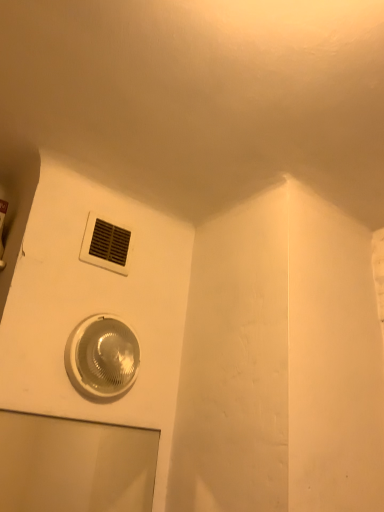
In order to face transparent glass door at lower left, should I rotate leftwards or rightwards?

Turn left by 14.356 degrees to look at transparent glass door at lower left.

Find the location of a particular element. transparent glass door at lower left is located at coordinates [x=74, y=465].

Between white plastic air conditioning at upper center and translucent plastic light fixture at lower center, which one is positioned behind?

white plastic air conditioning at upper center is behind.

Considering the positions of objects white plastic air conditioning at upper center and translucent plastic light fixture at lower center in the image provided, who is more to the right, white plastic air conditioning at upper center or translucent plastic light fixture at lower center?

translucent plastic light fixture at lower center is more to the right.

Is translucent plastic light fixture at lower center located within white plastic air conditioning at upper center?

Answer: No, translucent plastic light fixture at lower center is not inside white plastic air conditioning at upper center.

Is translucent plastic light fixture at lower center next to transparent glass door at lower left?

No, translucent plastic light fixture at lower center is not with transparent glass door at lower left.

Is translucent plastic light fixture at lower center positioned behind transparent glass door at lower left?

Yes.

Between translucent plastic light fixture at lower center and transparent glass door at lower left, which one appears on the left side from the viewer's perspective?

transparent glass door at lower left is more to the left.

Is white plastic air conditioning at upper center not near transparent glass door at lower left?

Yes, white plastic air conditioning at upper center is far from transparent glass door at lower left.

From the image's perspective, is white plastic air conditioning at upper center beneath transparent glass door at lower left?

No.

Does point (106, 221) appear closer or farther from the camera than point (0, 437)?

Point (106, 221) is positioned closer to the camera compared to point (0, 437).

From the picture: From a real-world perspective, which object stands above the other?

white plastic air conditioning at upper center is physically above.

Looking at this image, considering the relative sizes of transparent glass door at lower left and translucent plastic light fixture at lower center in the image provided, is transparent glass door at lower left smaller than translucent plastic light fixture at lower center?

Yes, transparent glass door at lower left is smaller than translucent plastic light fixture at lower center.

Is transparent glass door at lower left aimed at translucent plastic light fixture at lower center?

No, transparent glass door at lower left is not facing towards translucent plastic light fixture at lower center.

Is transparent glass door at lower left not within translucent plastic light fixture at lower center?

Yes, transparent glass door at lower left is not within translucent plastic light fixture at lower center.

Which of these two, transparent glass door at lower left or white plastic air conditioning at upper center, is bigger?

With larger size is transparent glass door at lower left.

Is transparent glass door at lower left positioned beyond the bounds of white plastic air conditioning at upper center?

transparent glass door at lower left lies outside white plastic air conditioning at upper center's area.

From the picture: Is transparent glass door at lower left in front of white plastic air conditioning at upper center?

Yes, transparent glass door at lower left is in front of white plastic air conditioning at upper center.

Is point (86, 374) positioned before point (86, 262)?

Yes.

Considering the sizes of objects translucent plastic light fixture at lower center and white plastic air conditioning at upper center in the image provided, who is thinner, translucent plastic light fixture at lower center or white plastic air conditioning at upper center?

white plastic air conditioning at upper center.

Is translucent plastic light fixture at lower center bigger or smaller than white plastic air conditioning at upper center?

translucent plastic light fixture at lower center is bigger than white plastic air conditioning at upper center.

At what (x,y) coordinates should I click in order to perform the action: click on air conditioning above the translucent plastic light fixture at lower center (from a real-world perspective). Please return your answer as a coordinate pair (x, y). Looking at the image, I should click on (105, 245).

Find the location of `glass door to the left of translucent plastic light fixture at lower center`. glass door to the left of translucent plastic light fixture at lower center is located at coordinates (74, 465).

Looking at this image, looking at the image, which one is located further to transparent glass door at lower left, white plastic air conditioning at upper center or translucent plastic light fixture at lower center?

white plastic air conditioning at upper center is positioned further to the anchor transparent glass door at lower left.

Estimate the real-world distances between objects in this image. Which object is closer to translucent plastic light fixture at lower center, white plastic air conditioning at upper center or transparent glass door at lower left?

white plastic air conditioning at upper center is positioned closer to the anchor translucent plastic light fixture at lower center.

Looking at the image, which one is located further to white plastic air conditioning at upper center, transparent glass door at lower left or translucent plastic light fixture at lower center?

The object further to white plastic air conditioning at upper center is transparent glass door at lower left.

Based on their spatial positions, is transparent glass door at lower left or white plastic air conditioning at upper center further from translucent plastic light fixture at lower center?

Based on the image, transparent glass door at lower left appears to be further to translucent plastic light fixture at lower center.

When comparing their distances from white plastic air conditioning at upper center, does translucent plastic light fixture at lower center or transparent glass door at lower left seem closer?

translucent plastic light fixture at lower center is closer to white plastic air conditioning at upper center.

From the image, which object appears to be nearer to transparent glass door at lower left, translucent plastic light fixture at lower center or white plastic air conditioning at upper center?

translucent plastic light fixture at lower center.

This screenshot has height=512, width=384. I want to click on home appliance between white plastic air conditioning at upper center and transparent glass door at lower left in the up-down direction, so click(x=102, y=357).